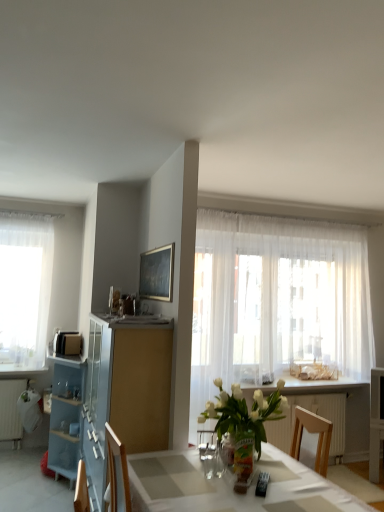
The image size is (384, 512). What do you see at coordinates (317, 414) in the screenshot?
I see `white plastic radiator at lower right, which appears as the 1th radiator when viewed from the right` at bounding box center [317, 414].

Locate an element on the screen. This screenshot has height=512, width=384. white plastic radiator at lower right, the second radiator from the left is located at coordinates (317, 414).

What is the approximate width of white glossy table at center?

The width of white glossy table at center is 1.08 meters.

Find the location of a particular element. This screenshot has width=384, height=512. white sheer curtain at left, the 2th curtain viewed from the right is located at coordinates (25, 288).

This screenshot has width=384, height=512. What do you see at coordinates (11, 410) in the screenshot?
I see `white matte radiator at lower left, which appears as the second radiator when viewed from the right` at bounding box center [11, 410].

Find the location of `matte black microwave at left`. matte black microwave at left is located at coordinates click(x=67, y=343).

At what (x,y) coordinates should I click in order to perform the action: click on blue glass cabinet at left. Please return your answer as a coordinate pair (x, y). This screenshot has width=384, height=512. Looking at the image, I should click on (125, 391).

From the image's perspective, which one is positioned lower, white matte radiator at lower left, marked as the first radiator in a left-to-right arrangement, or white sheer curtain at left, the 2th curtain viewed from the right?

white matte radiator at lower left, marked as the first radiator in a left-to-right arrangement.

Is white matte radiator at lower left, which appears as the second radiator when viewed from the right, touching white sheer curtain at left, the 2th curtain viewed from the right?

No, white matte radiator at lower left, which appears as the second radiator when viewed from the right, is not with white sheer curtain at left, the 2th curtain viewed from the right.

How different are the orientations of white matte radiator at lower left, which appears as the second radiator when viewed from the right, and white sheer curtain at left, the 1th curtain in the left-to-right sequence, in degrees?

The angle between the facing direction of white matte radiator at lower left, which appears as the second radiator when viewed from the right, and the facing direction of white sheer curtain at left, the 1th curtain in the left-to-right sequence, is 0.483 degrees.

Is white matte radiator at lower left, which appears as the second radiator when viewed from the right, positioned beyond the bounds of white sheer curtain at left, the 2th curtain viewed from the right?

Yes, white matte radiator at lower left, which appears as the second radiator when viewed from the right, is located beyond the bounds of white sheer curtain at left, the 2th curtain viewed from the right.

Can you confirm if sheer white curtain at right, the first curtain positioned from the right, is positioned to the left of matte black microwave at left?

No, sheer white curtain at right, the first curtain positioned from the right, is not to the left of matte black microwave at left.

From the picture: Is sheer white curtain at right, which is the 2th curtain in left-to-right order, not close to matte black microwave at left?

sheer white curtain at right, which is the 2th curtain in left-to-right order, is far away from matte black microwave at left.

The image size is (384, 512). I want to click on the 1st curtain directly above the matte black microwave at left (from a real-world perspective), so click(x=275, y=298).

Based on the photo, is clear glass vase at center far from white matte radiator at lower left, which appears as the second radiator when viewed from the right?

Indeed, clear glass vase at center is not near white matte radiator at lower left, which appears as the second radiator when viewed from the right.

From a real-world perspective, which is physically below, clear glass vase at center or white matte radiator at lower left, marked as the first radiator in a left-to-right arrangement?

white matte radiator at lower left, marked as the first radiator in a left-to-right arrangement, is physically lower.

Considering the sizes of clear glass vase at center and white matte radiator at lower left, which appears as the second radiator when viewed from the right, in the image, is clear glass vase at center taller or shorter than white matte radiator at lower left, which appears as the second radiator when viewed from the right,?

clear glass vase at center is shorter than white matte radiator at lower left, which appears as the second radiator when viewed from the right.

Considering the positions of objects white glass vase at center and white plastic radiator at lower right, the second radiator from the left, in the image provided, who is more to the left, white glass vase at center or white plastic radiator at lower right, the second radiator from the left,?

From the viewer's perspective, white glass vase at center appears more on the left side.

Would you say white plastic radiator at lower right, which appears as the 1th radiator when viewed from the right, is part of white glass vase at center's contents?

No.

Is white glass vase at center oriented towards white plastic radiator at lower right, which appears as the 1th radiator when viewed from the right?

No, white glass vase at center is not turned towards white plastic radiator at lower right, which appears as the 1th radiator when viewed from the right.

Is white glass vase at center with white plastic radiator at lower right, the second radiator from the left?

No, white glass vase at center is not making contact with white plastic radiator at lower right, the second radiator from the left.

Does clear glass vase at center turn towards sheer white curtain at right, the first curtain positioned from the right?

No, clear glass vase at center is not facing towards sheer white curtain at right, the first curtain positioned from the right.

Which object is closer to the camera, clear glass vase at center or sheer white curtain at right, which is the 2th curtain in left-to-right order?

clear glass vase at center is closer to the camera.

You are a GUI agent. You are given a task and a screenshot of the screen. Output one action in this format:
    pyautogui.click(x=<x>, y=<y>)
    Task: Click on the 1st curtain directly above the clear glass vase at center (from a real-world perspective)
    This screenshot has height=512, width=384.
    Given the screenshot: What is the action you would take?
    pyautogui.click(x=275, y=298)

Can you confirm if clear glass vase at center is shorter than sheer white curtain at right, which is the 2th curtain in left-to-right order?

Yes.

Considering the relative positions of matte black microwave at left and white glossy table at center in the image provided, is matte black microwave at left to the right of white glossy table at center from the viewer's perspective?

In fact, matte black microwave at left is to the left of white glossy table at center.

Is matte black microwave at left closer to the viewer compared to white glossy table at center?

That is False.

Consider the image. Is matte black microwave at left wider or thinner than white glossy table at center?

Clearly, matte black microwave at left has less width compared to white glossy table at center.

Can you see matte black microwave at left touching white glossy table at center?

No, matte black microwave at left is not in contact with white glossy table at center.

Does sheer white curtain at right, the first curtain positioned from the right, have a lesser width compared to white glossy counter top at center?

Correct, the width of sheer white curtain at right, the first curtain positioned from the right, is less than that of white glossy counter top at center.

Who is smaller, sheer white curtain at right, the first curtain positioned from the right, or white glossy counter top at center?

With smaller size is white glossy counter top at center.

Is sheer white curtain at right, the first curtain positioned from the right, outside of white glossy counter top at center?

sheer white curtain at right, the first curtain positioned from the right, lies outside white glossy counter top at center's area.

From a real-world perspective, which is physically below, sheer white curtain at right, which is the 2th curtain in left-to-right order, or white glossy counter top at center?

In real-world perspective, white glossy counter top at center is lower.

From the image's perspective, which curtain is the 2nd one above the white matte radiator at lower left, which appears as the second radiator when viewed from the right? Please provide its 2D coordinates.

[(25, 288)]

Where is `curtain to the right of matte black microwave at left`? The width and height of the screenshot is (384, 512). curtain to the right of matte black microwave at left is located at coordinates (275, 298).

Estimate the real-world distances between objects in this image. Which object is further from white glossy table at center, white glass vase at center or white matte radiator at lower left, marked as the first radiator in a left-to-right arrangement?

white matte radiator at lower left, marked as the first radiator in a left-to-right arrangement, lies further to white glossy table at center than the other object.

When comparing their distances from blue glass cabinet at left, does white matte radiator at lower left, which appears as the second radiator when viewed from the right, or white plastic radiator at lower right, the second radiator from the left, seem further?

white matte radiator at lower left, which appears as the second radiator when viewed from the right.

Which object lies further to the anchor point sheer white curtain at right, the first curtain positioned from the right, matte black microwave at left or white matte radiator at lower left, which appears as the second radiator when viewed from the right?

white matte radiator at lower left, which appears as the second radiator when viewed from the right, is further to sheer white curtain at right, the first curtain positioned from the right.

Which object lies nearer to the anchor point matte black microwave at left, white glass vase at center or white glossy table at center?

white glass vase at center is closer to matte black microwave at left.

Considering their positions, is white glossy table at center positioned further to sheer white curtain at right, the first curtain positioned from the right, than white plastic radiator at lower right, which appears as the 1th radiator when viewed from the right?

The object further to sheer white curtain at right, the first curtain positioned from the right, is white glossy table at center.

Based on their spatial positions, is sheer white curtain at right, the first curtain positioned from the right, or clear glass vase at center closer to white glass vase at center?

Among the two, clear glass vase at center is located nearer to white glass vase at center.

Which object lies further to the anchor point white plastic radiator at lower right, which appears as the 1th radiator when viewed from the right, white glossy table at center or clear glass vase at center?

Among the two, clear glass vase at center is located further to white plastic radiator at lower right, which appears as the 1th radiator when viewed from the right.

Estimate the real-world distances between objects in this image. Which object is further from clear glass vase at center, white matte radiator at lower left, marked as the first radiator in a left-to-right arrangement, or white glass vase at center?

white matte radiator at lower left, marked as the first radiator in a left-to-right arrangement, lies further to clear glass vase at center than the other object.

The width and height of the screenshot is (384, 512). What are the coordinates of `cabinetry between matte black microwave at left and sheer white curtain at right, the first curtain positioned from the right, in the horizontal direction` in the screenshot? It's located at (125, 391).

Identify the location of curtain between white glossy table at center and matte black microwave at left in the front-back direction. Image resolution: width=384 pixels, height=512 pixels. (275, 298).

At what (x,y) coordinates should I click in order to perform the action: click on vase between white matte radiator at lower left, which appears as the second radiator when viewed from the right, and sheer white curtain at right, the first curtain positioned from the right. Please return your answer as a coordinate pair (x, y). The image size is (384, 512). Looking at the image, I should click on (243, 460).

The width and height of the screenshot is (384, 512). In order to click on cabinetry between clear glass vase at center and white glossy counter top at center along the z-axis in this screenshot , I will do `click(125, 391)`.